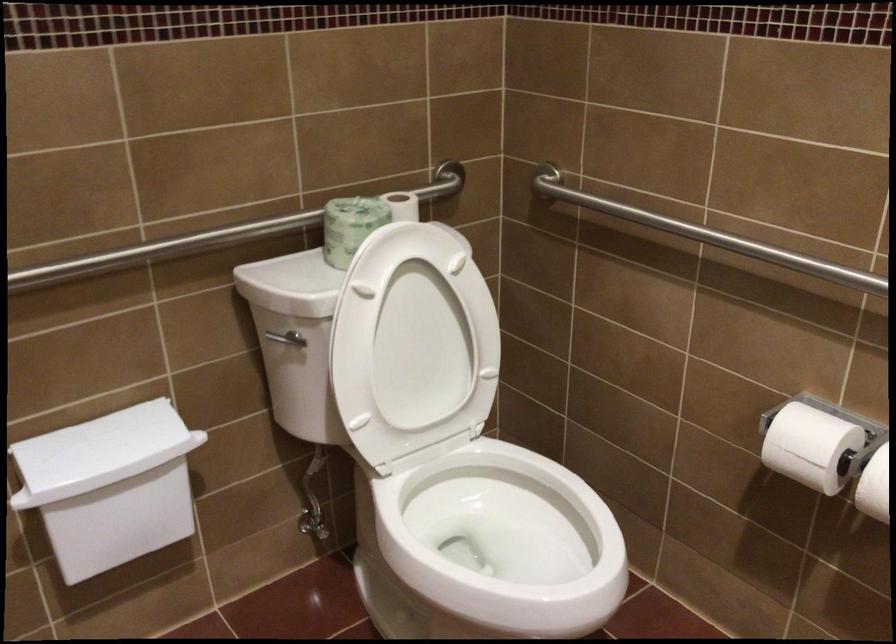
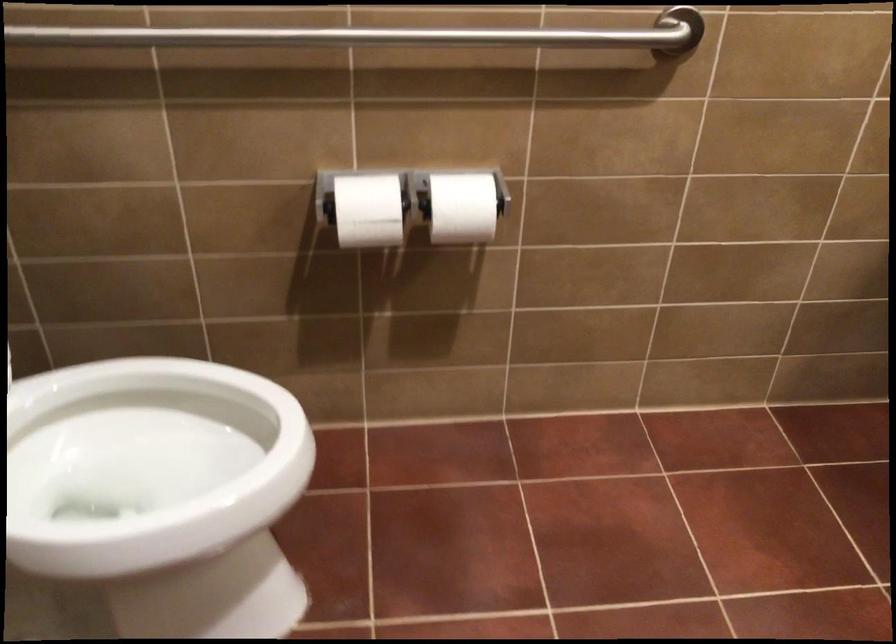
Where in the second image is the point corresponding to pixel 802 438 from the first image?

(367, 210)